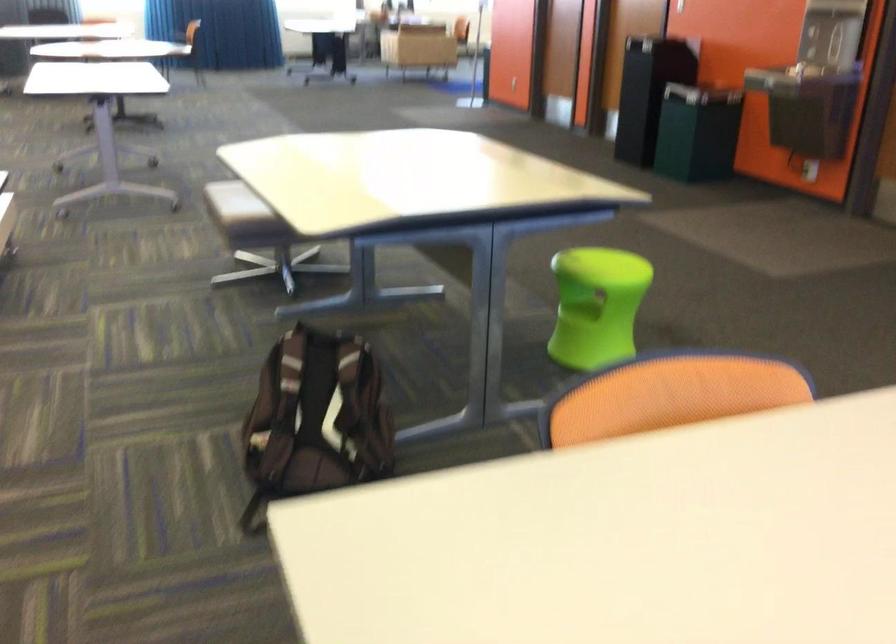
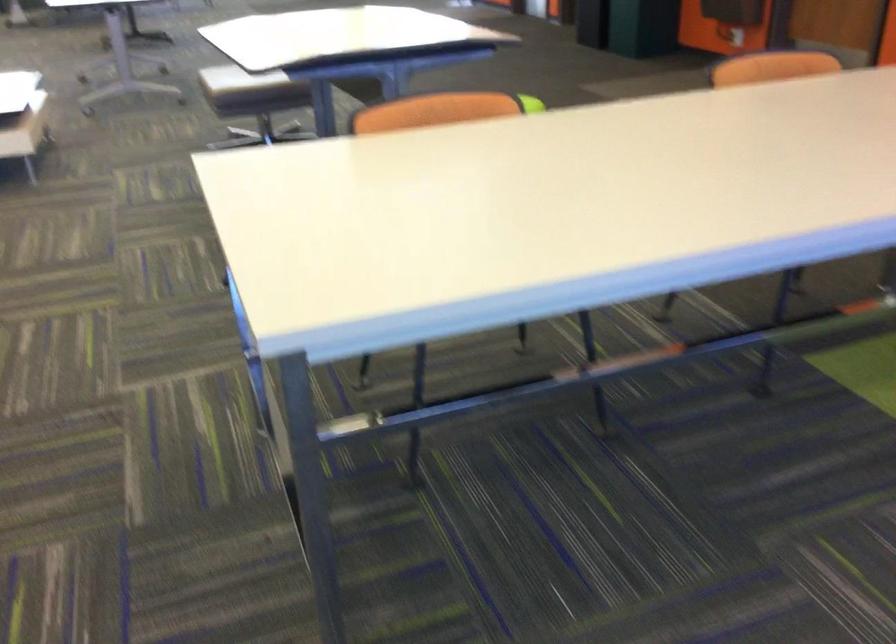
In a continuous first-person perspective shot, in which direction is the camera moving?

The cameraman moved toward right, backward.